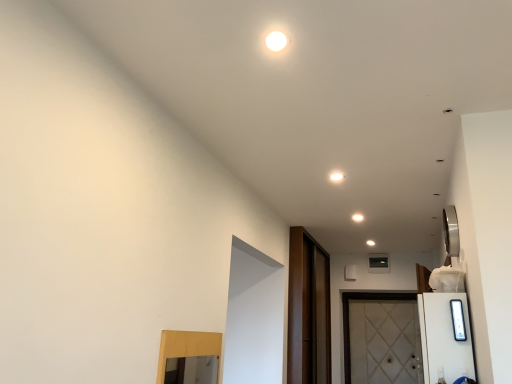
Question: Considering their positions, is white glossy light at upper center located in front of or behind white textured door at lower right?

Choices:
 (A) behind
 (B) front

Answer: (B)

Question: Is white glossy light at upper center inside or outside of white textured door at lower right?

Choices:
 (A) inside
 (B) outside

Answer: (B)

Question: Which object is the closest to the white glossy light at upper center?

Choices:
 (A) white textured door at lower right
 (B) dark brown wood screen door at center

Answer: (B)

Question: Considering the real-world distances, which object is closest to the white glossy light at upper center?

Choices:
 (A) dark brown wood screen door at center
 (B) white textured door at lower right

Answer: (A)